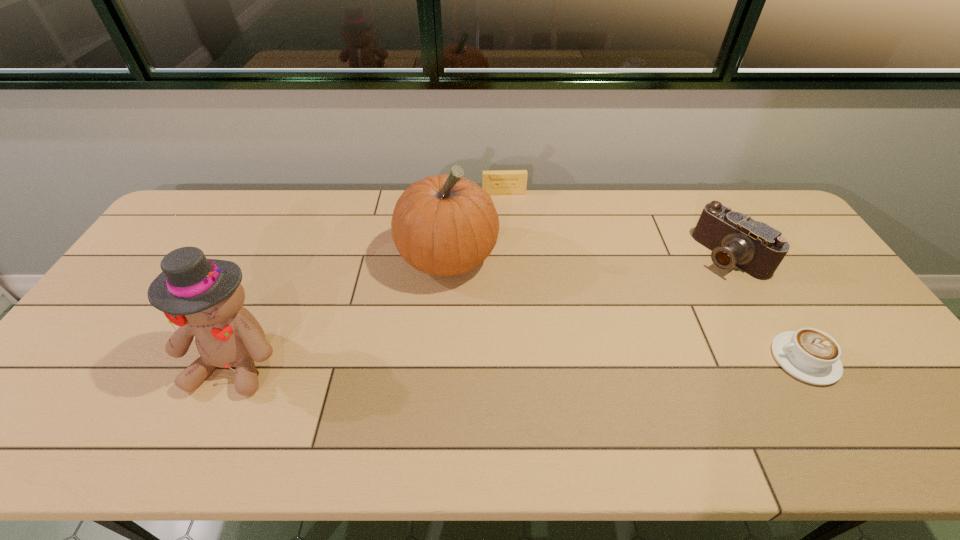
At what (x,y) coordinates should I click in order to perform the action: click on the leftmost object. Please return your answer as a coordinate pair (x, y). This screenshot has width=960, height=540. Looking at the image, I should click on (204, 297).

Identify the location of cappuccino. This screenshot has width=960, height=540. (810, 355).

Identify the location of pumpkin. Image resolution: width=960 pixels, height=540 pixels. (444, 225).

You are a GUI agent. You are given a task and a screenshot of the screen. Output one action in this format:
    pyautogui.click(x=<x>, y=<y>)
    Task: Click on the videotape
    The image size is (960, 540).
    Given the screenshot: What is the action you would take?
    pyautogui.click(x=501, y=182)

This screenshot has height=540, width=960. Find the location of `the fourth tallest object`. the fourth tallest object is located at coordinates (501, 182).

Find the location of `the third tallest object`. the third tallest object is located at coordinates (735, 239).

Locate an element on the screen. The width and height of the screenshot is (960, 540). free location located with the handle on the right side of the shortest object is located at coordinates (631, 359).

Locate an element on the screen. free spot located with the handle on the right side of the shortest object is located at coordinates (694, 359).

Identify the location of vacant space positioned with the handle on the right side of the shortest object. The width and height of the screenshot is (960, 540). (643, 359).

Locate an element on the screen. free region located 0.120m on the stem of the pumpkin is located at coordinates (492, 318).